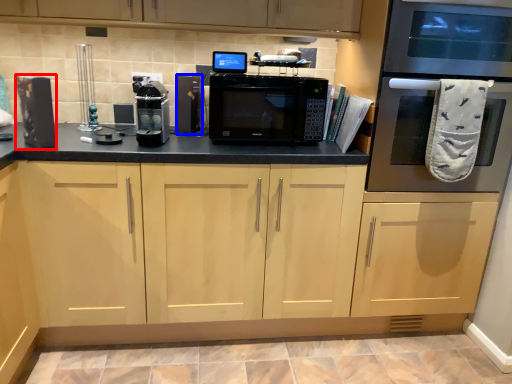
Question: Among these objects, which one is nearest to the camera, appliance (highlighted by a red box) or appliance (highlighted by a blue box)?

Choices:
 (A) appliance
 (B) appliance

Answer: (A)